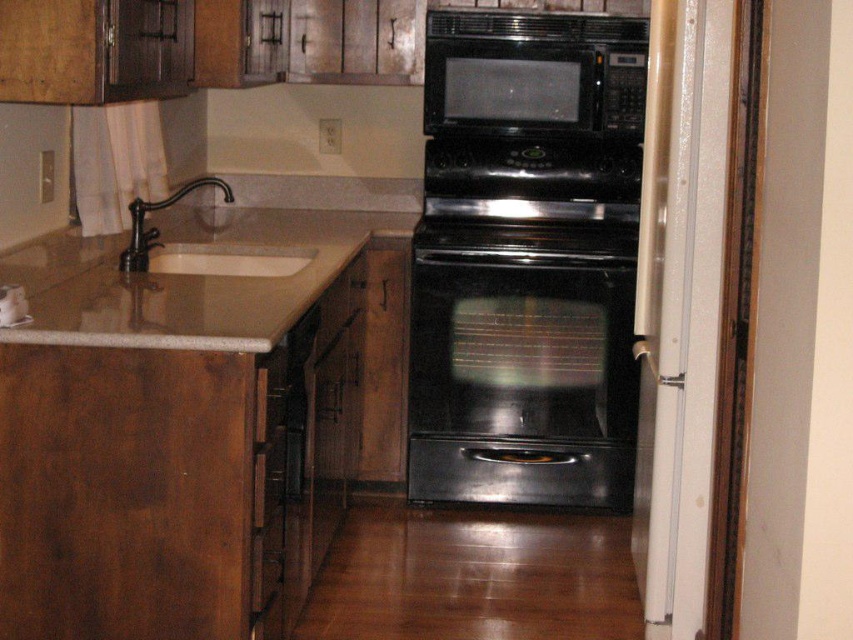
Can you confirm if black matte microwave at upper center is positioned above white glossy sink at left?

Correct, black matte microwave at upper center is located above white glossy sink at left.

Does black matte microwave at upper center appear on the right side of white glossy sink at left?

Yes, black matte microwave at upper center is to the right of white glossy sink at left.

Image resolution: width=853 pixels, height=640 pixels. What do you see at coordinates (534, 74) in the screenshot?
I see `black matte microwave at upper center` at bounding box center [534, 74].

You are a GUI agent. You are given a task and a screenshot of the screen. Output one action in this format:
    pyautogui.click(x=<x>, y=<y>)
    Task: Click on the black matte microwave at upper center
    The image size is (853, 640).
    Given the screenshot: What is the action you would take?
    pyautogui.click(x=534, y=74)

Between point (200, 227) and point (138, 269), which one is positioned in front?

Point (138, 269)

Does brown granite sink at left have a larger size compared to white glossy sink at left?

Correct, brown granite sink at left is larger in size than white glossy sink at left.

Is point (231, 324) positioned behind point (223, 195)?

No, (231, 324) is in front of (223, 195).

Where is `brown granite sink at left`? The height and width of the screenshot is (640, 853). brown granite sink at left is located at coordinates (194, 278).

Based on the photo, does black glossy oven at center have a greater width compared to white glossy sink at left?

Indeed, black glossy oven at center has a greater width compared to white glossy sink at left.

Between black glossy oven at center and white glossy sink at left, which one is positioned higher?

white glossy sink at left is higher up.

This screenshot has height=640, width=853. What do you see at coordinates (526, 260) in the screenshot?
I see `black glossy oven at center` at bounding box center [526, 260].

This screenshot has width=853, height=640. Find the location of `black glossy oven at center`. black glossy oven at center is located at coordinates (526, 260).